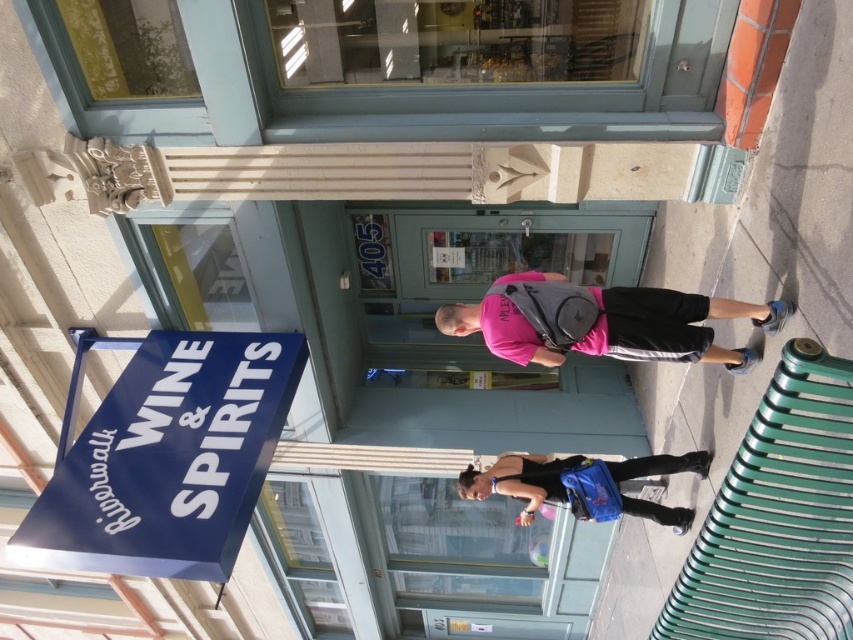
Which is behind, point (683, 342) or point (636, 509)?

The point (636, 509) is behind.

The width and height of the screenshot is (853, 640). Describe the element at coordinates (602, 321) in the screenshot. I see `pink matte t-shirt at center` at that location.

Describe the element at coordinates (602, 321) in the screenshot. I see `pink matte t-shirt at center` at that location.

Find the location of a particular element. This screenshot has width=853, height=640. pink matte t-shirt at center is located at coordinates (602, 321).